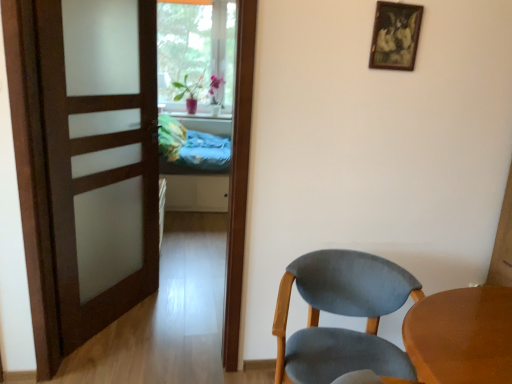
Question: From a real-world perspective, is blue fabric bed at center physically located above or below light blue fabric chair at lower right?

Choices:
 (A) below
 (B) above

Answer: (B)

Question: Choose the correct answer: Is blue fabric bed at center inside light blue fabric chair at lower right or outside it?

Choices:
 (A) inside
 (B) outside

Answer: (B)

Question: Which object is positioned farthest from the satin wood door at left?

Choices:
 (A) wooden picture frame at upper right
 (B) blue fabric bed at center
 (C) light blue fabric chair at lower right

Answer: (B)

Question: Which is farther from the satin wood door at left?

Choices:
 (A) wooden picture frame at upper right
 (B) blue fabric bed at center
 (C) light blue fabric chair at lower right

Answer: (B)